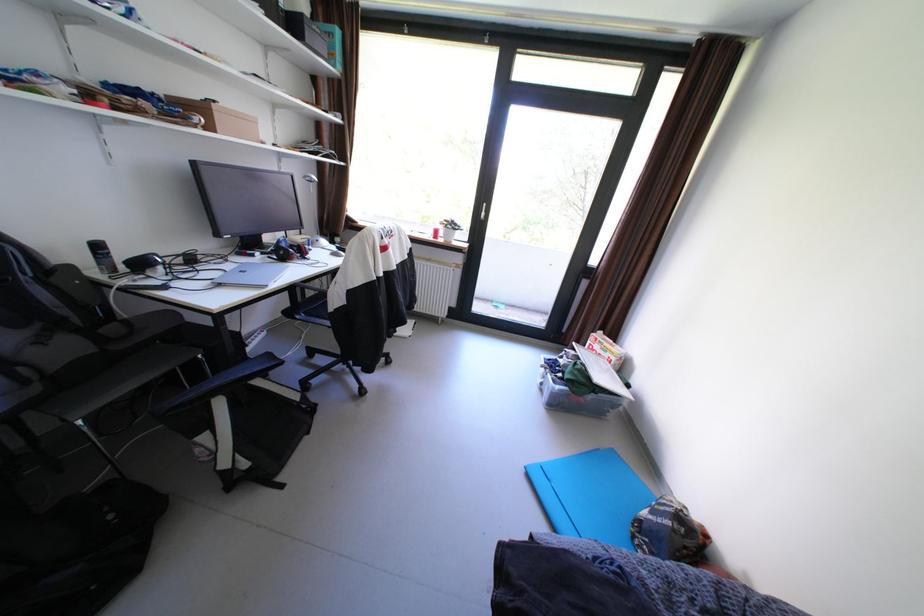
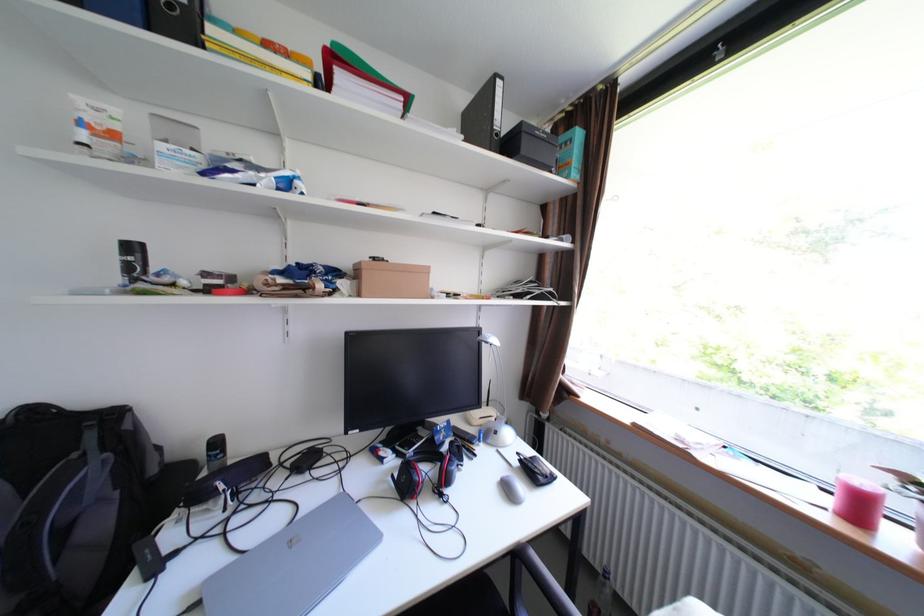
In the second image, find the point that corresponds to (x=229, y=285) in the first image.

(208, 604)